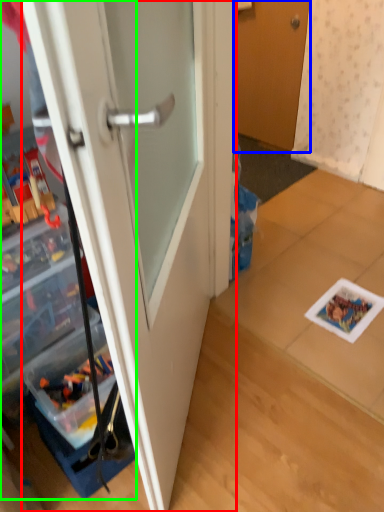
Question: Estimate the real-world distances between objects in this image. Which object is closer to door (highlighted by a red box), door (highlighted by a blue box) or cabinetry (highlighted by a green box)?

Choices:
 (A) door
 (B) cabinetry

Answer: (B)